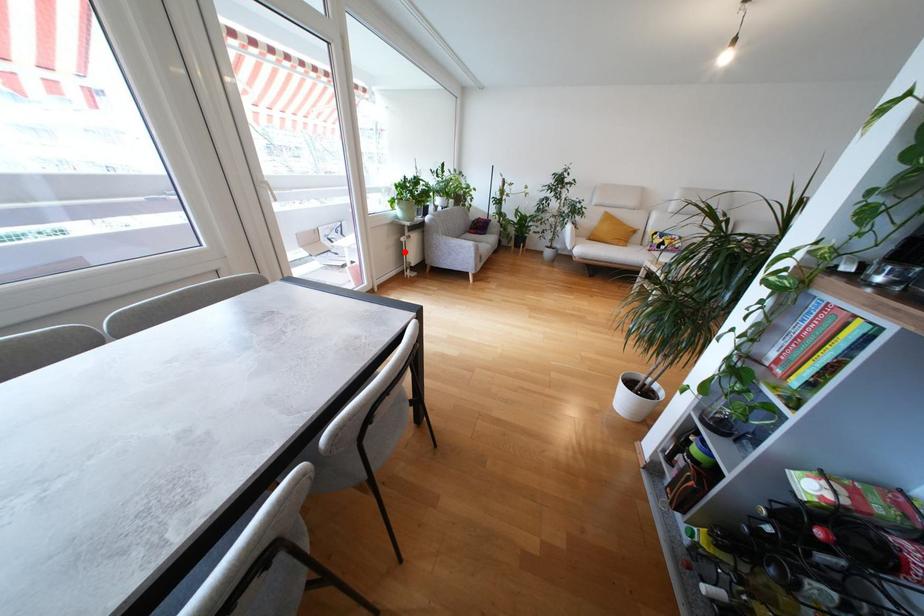
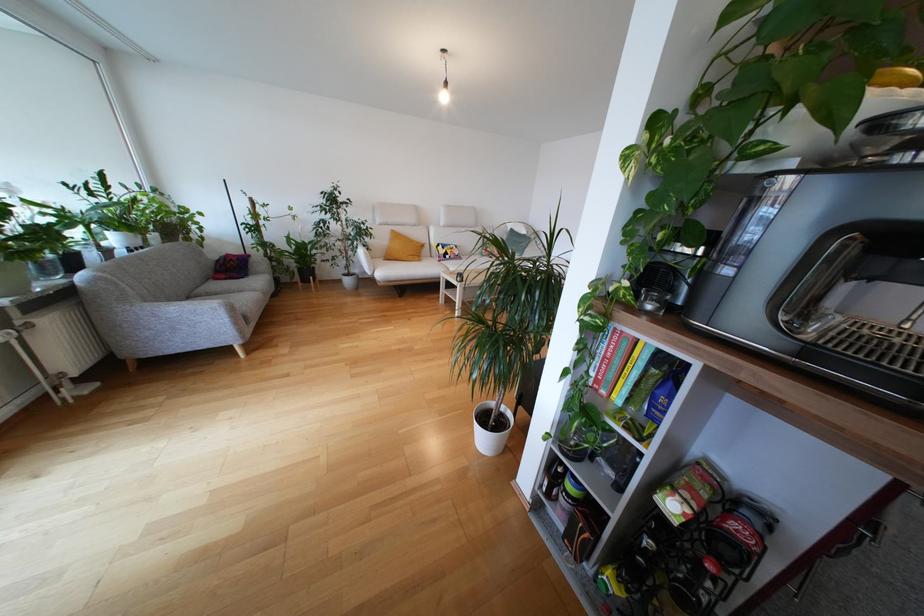
Locate, in the second image, the point that corresponds to the highlighted location in the first image.

(14, 361)